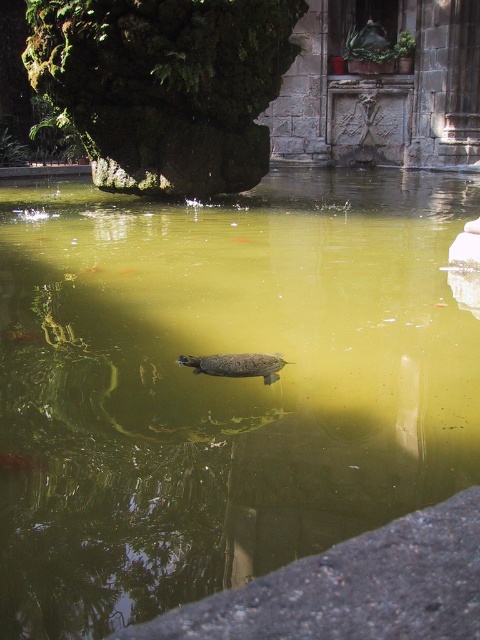
Question: Is green murky water at center positioned at the back of smooth brown tortoise at center?

Choices:
 (A) no
 (B) yes

Answer: (A)

Question: Among these points, which one is nearest to the camera?

Choices:
 (A) (249, 364)
 (B) (282, 180)

Answer: (A)

Question: Which point is closer to the camera taking this photo?

Choices:
 (A) (192, 356)
 (B) (429, 481)

Answer: (B)

Question: Does green murky water at center appear on the right side of smooth brown tortoise at center?

Choices:
 (A) no
 (B) yes

Answer: (B)

Question: Does green murky water at center appear over smooth brown tortoise at center?

Choices:
 (A) no
 (B) yes

Answer: (B)